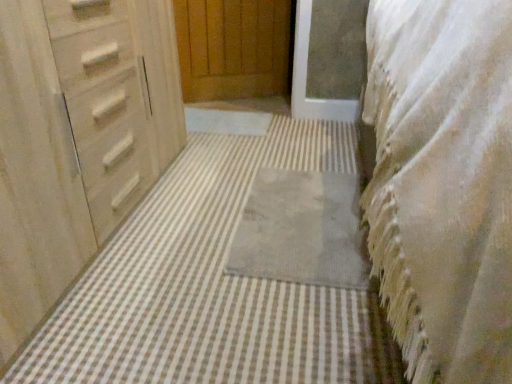
Question: Which direction should I rotate to look at gray soft rug at center, the second bath mat when ordered from front to back?

Choices:
 (A) right
 (B) left

Answer: (A)

Question: From a real-world perspective, is gray soft rug at center, the 2th bath mat when ordered from back to front, positioned over gray soft rug at center, positioned as the 1th bath mat in back-to-front order, based on gravity?

Choices:
 (A) yes
 (B) no

Answer: (B)

Question: Is gray soft rug at center, the 2th bath mat when ordered from back to front, next to gray soft rug at center, the second bath mat when ordered from front to back, and touching it?

Choices:
 (A) no
 (B) yes

Answer: (A)

Question: Would you say gray soft rug at center, the 2th bath mat when ordered from back to front, contains gray soft rug at center, positioned as the 1th bath mat in back-to-front order?

Choices:
 (A) no
 (B) yes

Answer: (B)

Question: Is gray soft rug at center, which is the 1th bath mat in front-to-back order, oriented away from gray soft rug at center, the second bath mat when ordered from front to back?

Choices:
 (A) yes
 (B) no

Answer: (B)

Question: Does gray soft rug at center, the 2th bath mat when ordered from back to front, have a larger size compared to gray soft rug at center, positioned as the 1th bath mat in back-to-front order?

Choices:
 (A) no
 (B) yes

Answer: (B)

Question: From the image's perspective, would you say gray soft rug at center, which is the 1th bath mat in front-to-back order, is shown under gray soft rug at center, the second bath mat when ordered from front to back?

Choices:
 (A) yes
 (B) no

Answer: (B)

Question: Can you confirm if white textured blanket at right is positioned to the right of gray soft rug at center, which is the 1th bath mat in front-to-back order?

Choices:
 (A) yes
 (B) no

Answer: (A)

Question: Is white textured blanket at right shorter than gray soft rug at center, the 2th bath mat when ordered from back to front?

Choices:
 (A) no
 (B) yes

Answer: (A)

Question: Considering the relative sizes of white textured blanket at right and gray soft rug at center, which is the 1th bath mat in front-to-back order, in the image provided, is white textured blanket at right wider than gray soft rug at center, which is the 1th bath mat in front-to-back order,?

Choices:
 (A) no
 (B) yes

Answer: (B)

Question: Is white textured blanket at right positioned behind gray soft rug at center, which is the 1th bath mat in front-to-back order?

Choices:
 (A) no
 (B) yes

Answer: (A)

Question: Could you tell me if white textured blanket at right is turned towards gray soft rug at center, which is the 1th bath mat in front-to-back order?

Choices:
 (A) no
 (B) yes

Answer: (A)

Question: Is white textured blanket at right thinner than gray soft rug at center, the 2th bath mat when ordered from back to front?

Choices:
 (A) yes
 (B) no

Answer: (B)

Question: Can you confirm if gray soft rug at center, the second bath mat when ordered from front to back, is bigger than gray soft rug at center, the 2th bath mat when ordered from back to front?

Choices:
 (A) no
 (B) yes

Answer: (A)